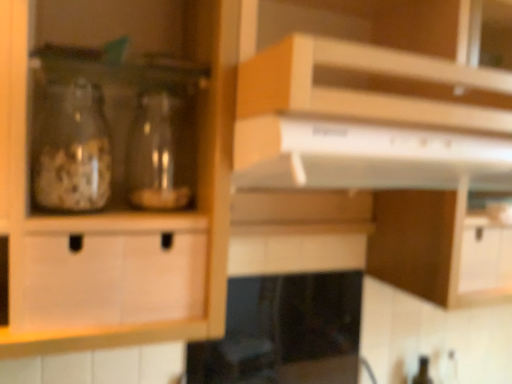
In order to face white glossy exhaust hood at upper center, should I rotate leftwards or rightwards?

Rotate your view right by about 11.684°.

The width and height of the screenshot is (512, 384). What do you see at coordinates (158, 153) in the screenshot? I see `transparent glass jar at center, marked as the second glass bottle in a left-to-right arrangement` at bounding box center [158, 153].

What do you see at coordinates (72, 149) in the screenshot? The width and height of the screenshot is (512, 384). I see `transparent glass jar at left, the first glass bottle from the left` at bounding box center [72, 149].

This screenshot has height=384, width=512. What are the coordinates of `black glass stove at lower center` in the screenshot? It's located at (284, 332).

Would you say white glossy exhaust hood at upper center is outside transparent glass jar at center, arranged as the 1th glass bottle when viewed from the right?

white glossy exhaust hood at upper center lies outside transparent glass jar at center, arranged as the 1th glass bottle when viewed from the right,'s area.

Can you see white glossy exhaust hood at upper center touching transparent glass jar at center, marked as the second glass bottle in a left-to-right arrangement?

No.

Considering the positions of point (394, 165) and point (128, 173), is point (394, 165) closer or farther from the camera than point (128, 173)?

Point (394, 165) appears to be closer to the viewer than point (128, 173).

Does point (158, 191) lie behind point (66, 112)?

No, it is in front of (66, 112).

Identify the location of glass bottle above the transparent glass jar at left, the first glass bottle from the left (from a real-world perspective). The image size is (512, 384). (158, 153).

Is transparent glass jar at center, arranged as the 1th glass bottle when viewed from the right, facing towards transparent glass jar at left, the 2th glass bottle when ordered from right to left?

No, transparent glass jar at center, arranged as the 1th glass bottle when viewed from the right, is not oriented towards transparent glass jar at left, the 2th glass bottle when ordered from right to left.

Is transparent glass jar at center, marked as the second glass bottle in a left-to-right arrangement, not inside white glossy exhaust hood at upper center?

Indeed, transparent glass jar at center, marked as the second glass bottle in a left-to-right arrangement, is completely outside white glossy exhaust hood at upper center.

Is transparent glass jar at center, arranged as the 1th glass bottle when viewed from the right, at the left side of white glossy exhaust hood at upper center?

Correct, you'll find transparent glass jar at center, arranged as the 1th glass bottle when viewed from the right, to the left of white glossy exhaust hood at upper center.

Which object is further away from the camera taking this photo, transparent glass jar at center, marked as the second glass bottle in a left-to-right arrangement, or white glossy exhaust hood at upper center?

transparent glass jar at center, marked as the second glass bottle in a left-to-right arrangement, is further away from the camera.

Is transparent glass jar at center, arranged as the 1th glass bottle when viewed from the right, far away from white glossy exhaust hood at upper center?

transparent glass jar at center, arranged as the 1th glass bottle when viewed from the right, is near white glossy exhaust hood at upper center, not far away.

From the image's perspective, is transparent glass jar at left, the 2th glass bottle when ordered from right to left, located above or below transparent glass jar at center, arranged as the 1th glass bottle when viewed from the right?

transparent glass jar at left, the 2th glass bottle when ordered from right to left, is above transparent glass jar at center, arranged as the 1th glass bottle when viewed from the right.

From the picture: Which is in front, transparent glass jar at left, the first glass bottle from the left, or transparent glass jar at center, marked as the second glass bottle in a left-to-right arrangement?

transparent glass jar at left, the first glass bottle from the left, is closer to the camera.

Which is closer to the camera, [77,102] or [185,173]?

Point [77,102] is farther from the camera than point [185,173].

Considering the sizes of objects transparent glass jar at left, the 2th glass bottle when ordered from right to left, and transparent glass jar at center, arranged as the 1th glass bottle when viewed from the right, in the image provided, who is smaller, transparent glass jar at left, the 2th glass bottle when ordered from right to left, or transparent glass jar at center, arranged as the 1th glass bottle when viewed from the right,?

Smaller between the two is transparent glass jar at center, arranged as the 1th glass bottle when viewed from the right.

From a real-world perspective, which object stands above the other?

In real-world perspective, white glossy exhaust hood at upper center is above.

Considering the sizes of objects white glossy exhaust hood at upper center and black glass stove at lower center in the image provided, who is wider, white glossy exhaust hood at upper center or black glass stove at lower center?

black glass stove at lower center is wider.

Looking at the image, does white glossy exhaust hood at upper center seem bigger or smaller compared to black glass stove at lower center?

Considering their sizes, white glossy exhaust hood at upper center takes up less space than black glass stove at lower center.

The height and width of the screenshot is (384, 512). Identify the location of the 1st glass bottle positioned above the black glass stove at lower center (from the image's perspective). click(158, 153).

Is transparent glass jar at center, marked as the second glass bottle in a left-to-right arrangement, positioned beyond the bounds of black glass stove at lower center?

Yes, transparent glass jar at center, marked as the second glass bottle in a left-to-right arrangement, is located beyond the bounds of black glass stove at lower center.

From a real-world perspective, is transparent glass jar at center, marked as the second glass bottle in a left-to-right arrangement, located beneath black glass stove at lower center?

No, from a real-world perspective, transparent glass jar at center, marked as the second glass bottle in a left-to-right arrangement, is not under black glass stove at lower center.

Is point (152, 158) positioned after point (325, 275)?

No, (152, 158) is closer to viewer.

From the image's perspective, which is above, black glass stove at lower center or white glossy exhaust hood at upper center?

white glossy exhaust hood at upper center, from the image's perspective.

Based on their sizes in the image, would you say black glass stove at lower center is bigger or smaller than white glossy exhaust hood at upper center?

In the image, black glass stove at lower center appears to be larger than white glossy exhaust hood at upper center.

Which point is more distant from viewer, (329, 289) or (324, 165)?

The point (329, 289) is more distant.

Image resolution: width=512 pixels, height=384 pixels. Find the location of `exhaust hood below the transparent glass jar at center, arranged as the 1th glass bottle when viewed from the right (from a real-world perspective)`. exhaust hood below the transparent glass jar at center, arranged as the 1th glass bottle when viewed from the right (from a real-world perspective) is located at coordinates (364, 156).

Identify the location of glass bottle on the right of transparent glass jar at left, the 2th glass bottle when ordered from right to left. (158, 153).

Based on their spatial positions, is white glossy exhaust hood at upper center or transparent glass jar at left, the first glass bottle from the left, closer to transparent glass jar at center, marked as the second glass bottle in a left-to-right arrangement?

Among the two, transparent glass jar at left, the first glass bottle from the left, is located nearer to transparent glass jar at center, marked as the second glass bottle in a left-to-right arrangement.

Looking at the image, which one is located further to white glossy exhaust hood at upper center, transparent glass jar at left, the first glass bottle from the left, or transparent glass jar at center, arranged as the 1th glass bottle when viewed from the right?

transparent glass jar at left, the first glass bottle from the left, lies further to white glossy exhaust hood at upper center than the other object.

Looking at this image, based on their spatial positions, is black glass stove at lower center or transparent glass jar at left, the 2th glass bottle when ordered from right to left, closer to transparent glass jar at center, marked as the second glass bottle in a left-to-right arrangement?

transparent glass jar at left, the 2th glass bottle when ordered from right to left, is positioned closer to the anchor transparent glass jar at center, marked as the second glass bottle in a left-to-right arrangement.

Considering their positions, is transparent glass jar at center, arranged as the 1th glass bottle when viewed from the right, positioned further to white glossy exhaust hood at upper center than black glass stove at lower center?

Based on the image, black glass stove at lower center appears to be further to white glossy exhaust hood at upper center.

Estimate the real-world distances between objects in this image. Which object is closer to black glass stove at lower center, transparent glass jar at center, marked as the second glass bottle in a left-to-right arrangement, or white glossy exhaust hood at upper center?

white glossy exhaust hood at upper center lies closer to black glass stove at lower center than the other object.

Looking at this image, when comparing their distances from transparent glass jar at center, marked as the second glass bottle in a left-to-right arrangement, does transparent glass jar at left, the first glass bottle from the left, or black glass stove at lower center seem closer?

The object closer to transparent glass jar at center, marked as the second glass bottle in a left-to-right arrangement, is transparent glass jar at left, the first glass bottle from the left.

Considering their positions, is transparent glass jar at left, the 2th glass bottle when ordered from right to left, positioned further to white glossy exhaust hood at upper center than black glass stove at lower center?

black glass stove at lower center is positioned further to the anchor white glossy exhaust hood at upper center.

Based on their spatial positions, is black glass stove at lower center or transparent glass jar at center, marked as the second glass bottle in a left-to-right arrangement, further from transparent glass jar at left, the first glass bottle from the left?

Among the two, black glass stove at lower center is located further to transparent glass jar at left, the first glass bottle from the left.

Where is `exhaust hood between transparent glass jar at center, marked as the second glass bottle in a left-to-right arrangement, and black glass stove at lower center vertically`? This screenshot has width=512, height=384. exhaust hood between transparent glass jar at center, marked as the second glass bottle in a left-to-right arrangement, and black glass stove at lower center vertically is located at coordinates (364, 156).

The height and width of the screenshot is (384, 512). What are the coordinates of `appliance situated between transparent glass jar at left, the first glass bottle from the left, and white glossy exhaust hood at upper center from left to right` in the screenshot? It's located at (284, 332).

What are the coordinates of `glass bottle between transparent glass jar at left, the first glass bottle from the left, and white glossy exhaust hood at upper center, in the horizontal direction` in the screenshot? It's located at (158, 153).

At what (x,y) coordinates should I click in order to perform the action: click on glass bottle between transparent glass jar at left, the 2th glass bottle when ordered from right to left, and black glass stove at lower center, in the vertical direction. Please return your answer as a coordinate pair (x, y). The height and width of the screenshot is (384, 512). Looking at the image, I should click on (158, 153).